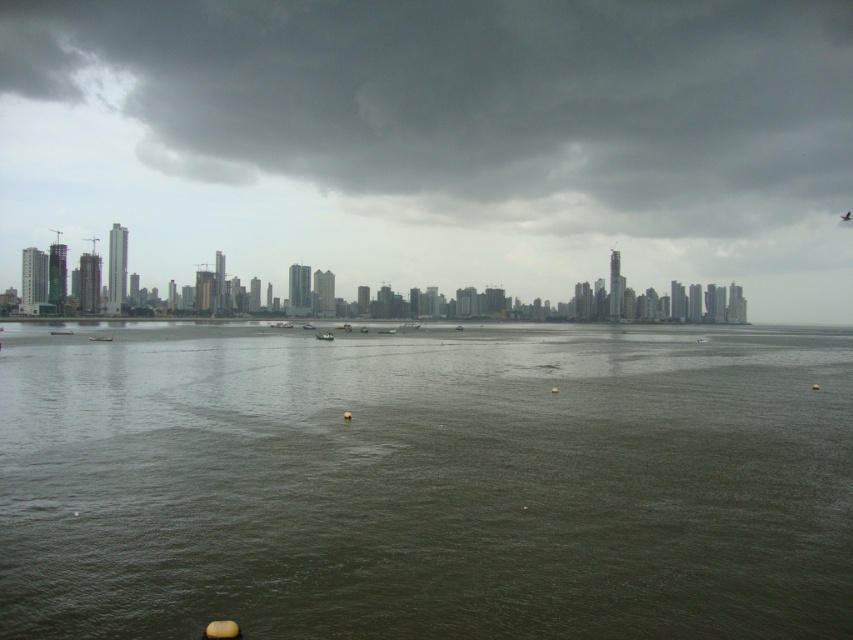
You are a weather balloon operator who needs to determine if your balloon can safely ascend above the dark green water at center without colliding with the dark gray cloud at upper center. Given that the balloon can reach up to 100 meters in altitude, can it safely ascend without hitting the cloud?

The dark green water at center has a smaller size compared to dark gray cloud at upper center, but the description does not provide information about their vertical distances or altitudes. Therefore, it is impossible to determine if the balloon can safely ascend without hitting the cloud based on the given details.

What is the location of the dark green water at center in the image?

The dark green water at center is located at point coordinates of approximately 0.752 on the x axis and 0.499 on the y axis.

You are a weather balloon operator observing the cityscape. You notice the dark green water at center and the dark gray cloud at upper center. Which object is located to the left of the other?

The dark gray cloud at upper center is located to the left of the dark green water at center.